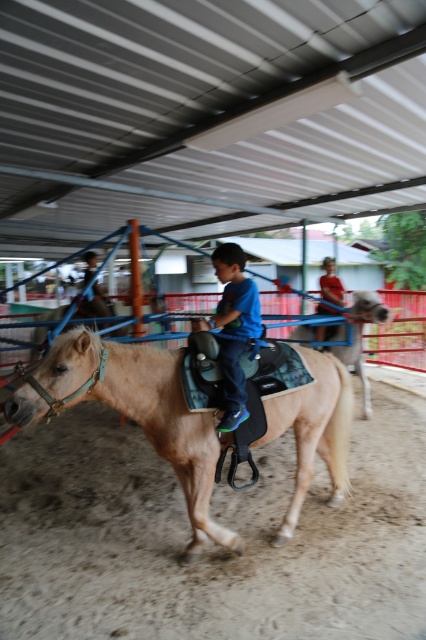
Does light brown leather saddle at center lie behind blue matte shirt at center?

No, it is in front of blue matte shirt at center.

Can you confirm if light brown leather saddle at center is bigger than blue matte shirt at center?

Correct, light brown leather saddle at center is larger in size than blue matte shirt at center.

Is point (138, 362) positioned behind point (256, 326)?

That is False.

This screenshot has width=426, height=640. What are the coordinates of `light brown leather saddle at center` in the screenshot? It's located at (134, 412).

Is light brown leather horse at center below light brown leather jacket at center?

Indeed, light brown leather horse at center is positioned under light brown leather jacket at center.

Can you confirm if light brown leather horse at center is positioned to the left of light brown leather jacket at center?

No, light brown leather horse at center is not to the left of light brown leather jacket at center.

Image resolution: width=426 pixels, height=640 pixels. What are the coordinates of `light brown leather horse at center` in the screenshot? It's located at (354, 364).

Does point (227, 323) come behind point (328, 339)?

No.

Which is behind, point (230, 314) or point (377, 308)?

The point (377, 308) is behind.

Is point (213, 262) closer to viewer compared to point (337, 346)?

That is True.

Locate an element on the screen. The height and width of the screenshot is (640, 426). blue matte shirt at center is located at coordinates (233, 328).